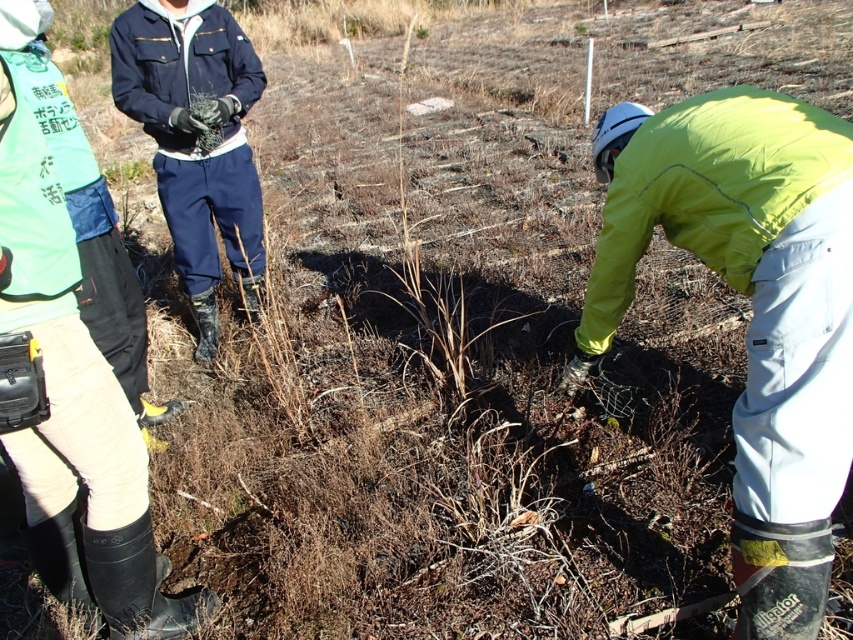
Question: Can you confirm if neon yellow jacket at lower right is bigger than dark blue fabric jacket at upper left?

Choices:
 (A) no
 (B) yes

Answer: (A)

Question: Which object is the farthest from the dark blue fabric jacket at upper left?

Choices:
 (A) matte black rubber boots at lower left
 (B) neon yellow jacket at lower right

Answer: (B)

Question: Which is farther from the dark blue fabric jacket at upper left?

Choices:
 (A) matte black rubber boots at lower left
 (B) neon yellow jacket at lower right

Answer: (B)

Question: Does neon yellow jacket at lower right have a lesser width compared to matte black rubber boots at lower left?

Choices:
 (A) no
 (B) yes

Answer: (A)

Question: Is neon yellow jacket at lower right positioned before dark blue fabric jacket at upper left?

Choices:
 (A) no
 (B) yes

Answer: (B)

Question: Which of the following is the farthest from the observer?

Choices:
 (A) neon yellow jacket at lower right
 (B) matte black rubber boots at lower left
 (C) dark blue fabric jacket at upper left

Answer: (C)